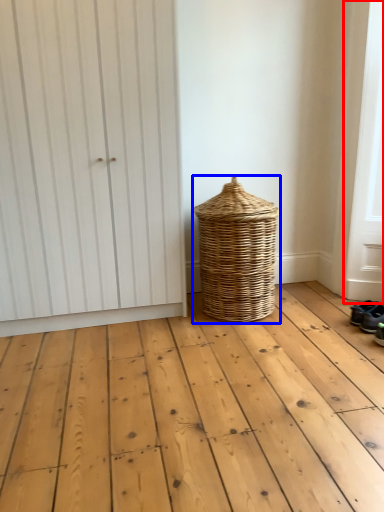
Question: Which of the following is the farthest to the observer, screen door (highlighted by a red box) or basket (highlighted by a blue box)?

Choices:
 (A) screen door
 (B) basket

Answer: (B)